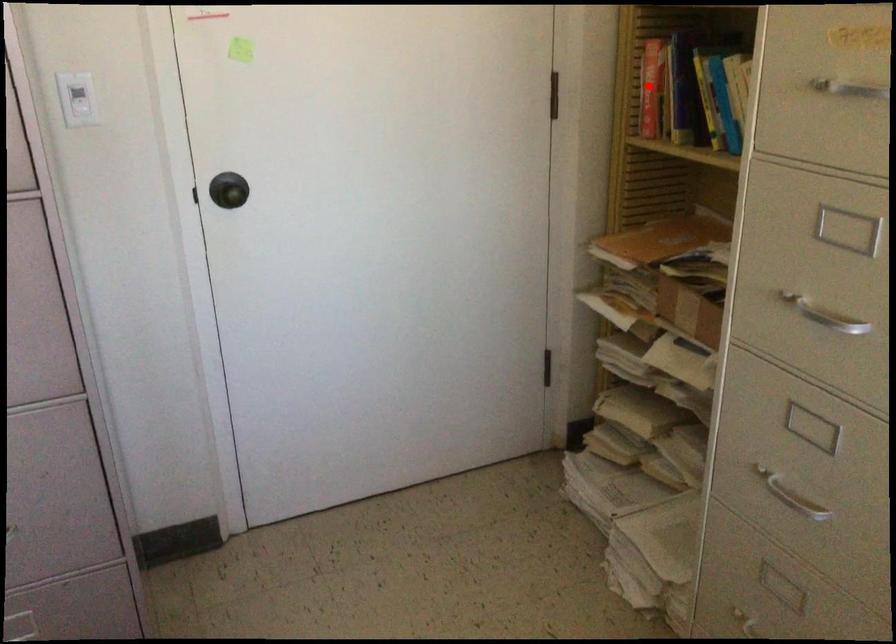
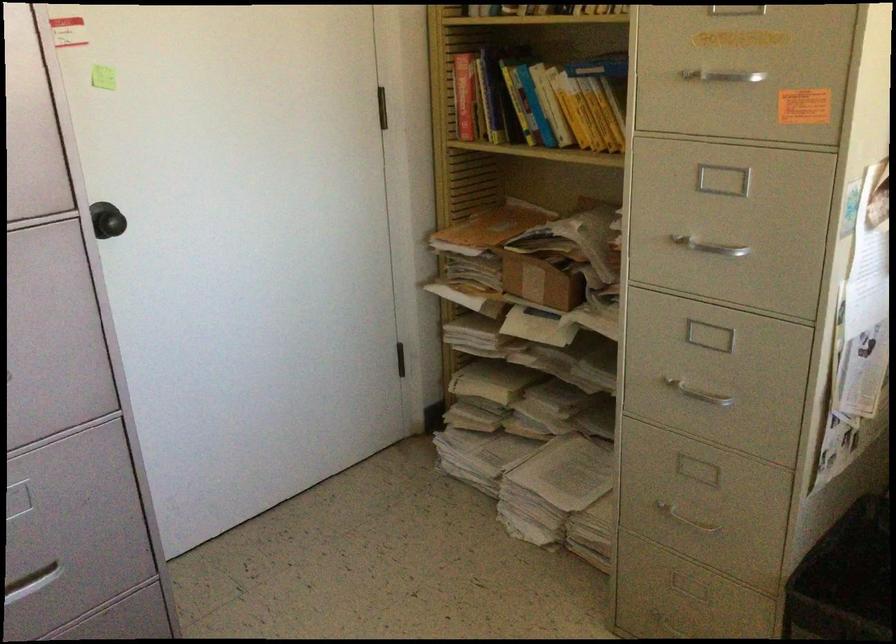
The point at the highlighted location is marked in the first image. Where is the corresponding point in the second image?

(464, 96)